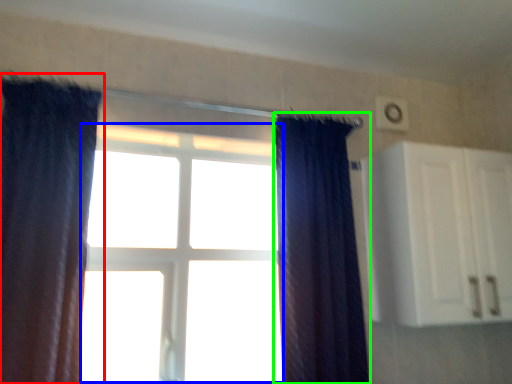
Question: Based on their relative distances, which object is farther from curtain (highlighted by a red box)? Choose from bay window (highlighted by a blue box) and curtain (highlighted by a green box).

Choices:
 (A) bay window
 (B) curtain

Answer: (B)